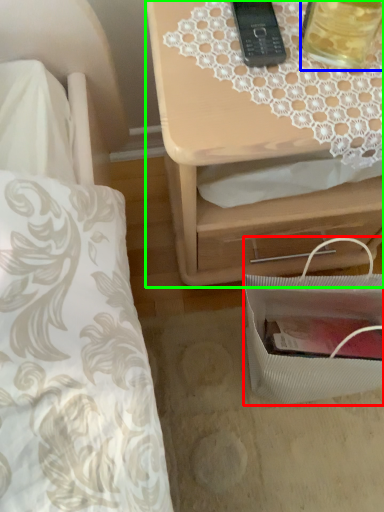
Question: Based on their relative distances, which object is nearer to bag (highlighted by a red box)? Choose from beverage (highlighted by a blue box) and nightstand (highlighted by a green box).

Choices:
 (A) beverage
 (B) nightstand

Answer: (B)